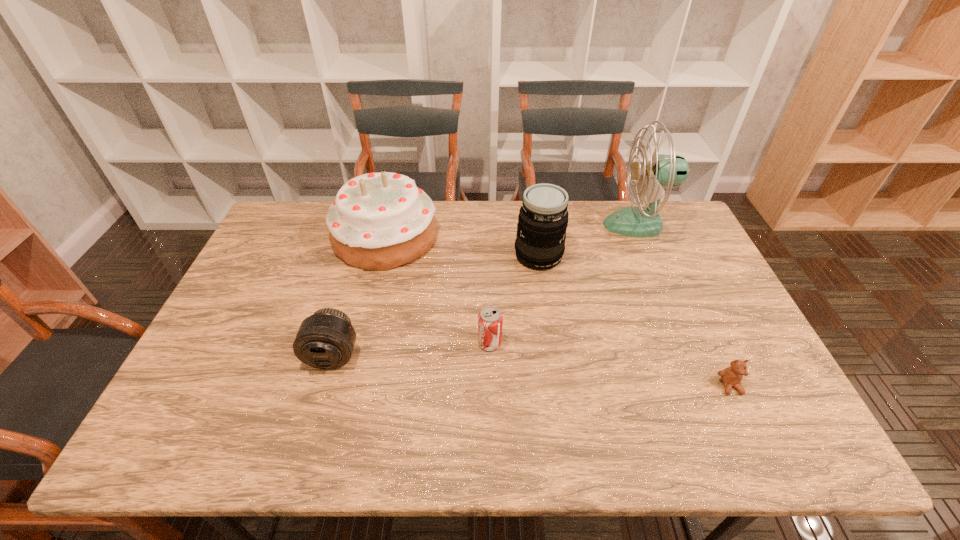
In order to click on fan situated at the right edge in this screenshot , I will do `click(662, 170)`.

Find the location of `teddy bear located in the right edge section of the desktop`. teddy bear located in the right edge section of the desktop is located at coordinates (731, 376).

I want to click on object that is at the far right corner, so click(662, 170).

Where is `vacant area at the far edge of the desktop`? vacant area at the far edge of the desktop is located at coordinates (511, 202).

Identify the location of vacant space at the near edge. (603, 423).

Locate an element on the screen. The width and height of the screenshot is (960, 540). free space at the left edge of the desktop is located at coordinates (273, 245).

The image size is (960, 540). In order to click on free region at the right edge in this screenshot , I will do `click(660, 266)`.

The width and height of the screenshot is (960, 540). In order to click on free space at the far left corner in this screenshot , I will do `click(324, 206)`.

In the image, there is a desktop. Where is `free space at the near right corner`? This screenshot has width=960, height=540. free space at the near right corner is located at coordinates (765, 422).

What are the coordinates of `vacant area that lies between the farther telephoto lens and the teddy bear` in the screenshot? It's located at (635, 321).